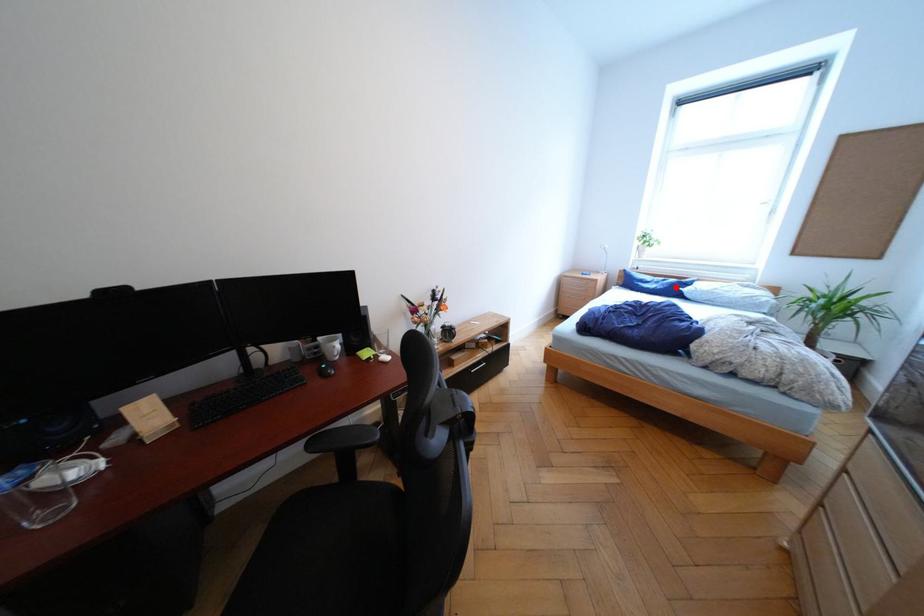
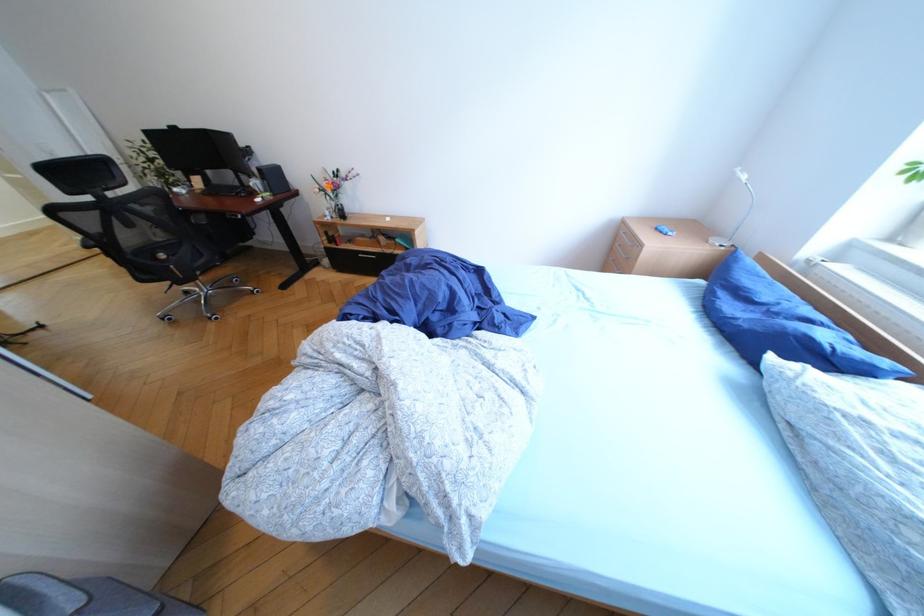
Locate, in the second image, the point that corresponds to the highlighted location in the first image.

(768, 330)